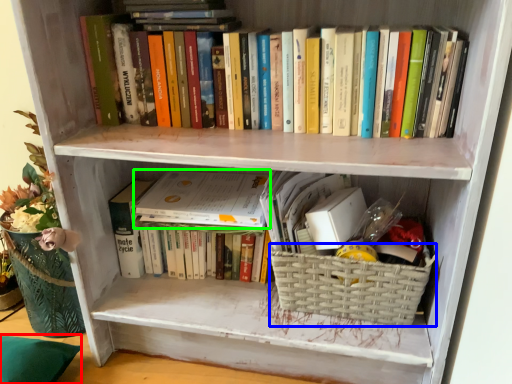
Question: Which is farther away from pillow (highlighted by a red box)? basket (highlighted by a blue box) or paperback book (highlighted by a green box)?

Choices:
 (A) basket
 (B) paperback book

Answer: (A)